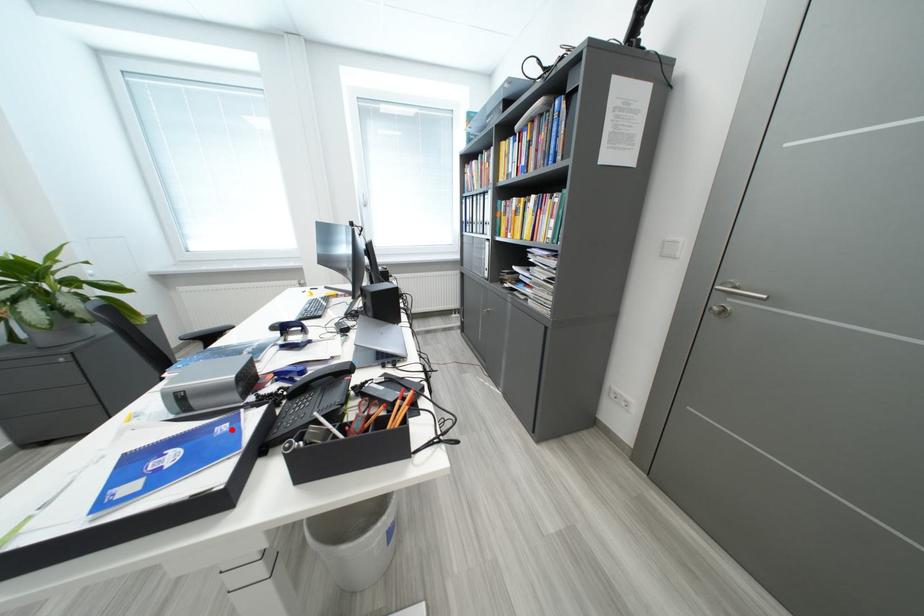
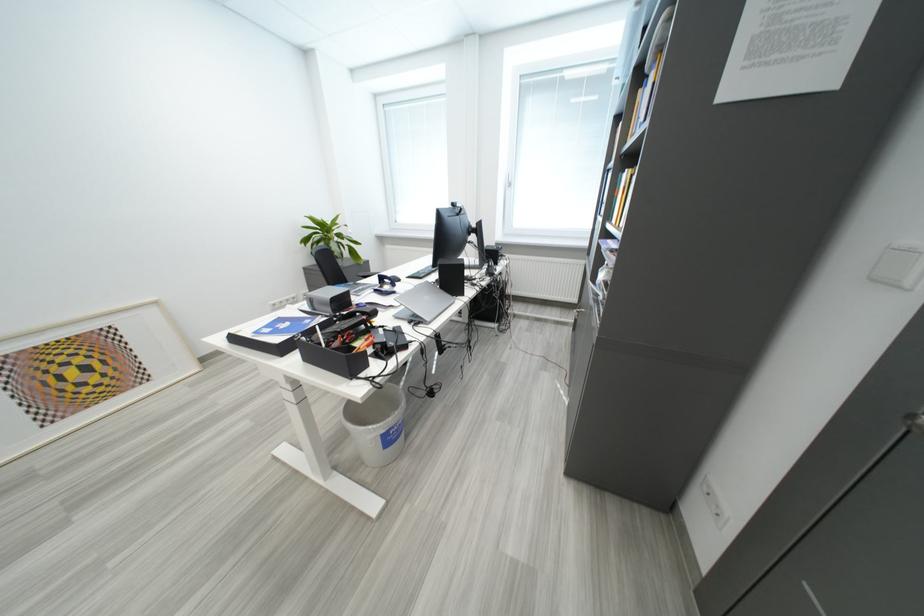
Where in the second image is the point corresponding to the highlighted location from the first image?

(317, 323)